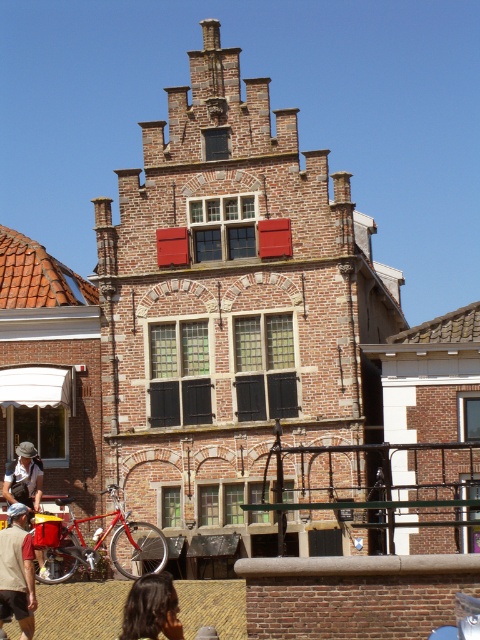
Consider the image. Can you confirm if green glass window at center is positioned above dark brown hair at lower left?

Yes, green glass window at center is above dark brown hair at lower left.

Is point (181, 348) farther from viewer compared to point (164, 588)?

Yes, point (181, 348) is farther from viewer.

This screenshot has width=480, height=640. I want to click on green glass window at center, so click(x=180, y=372).

Can you confirm if matte red shutter at center is positioned to the right of red matte shutter at upper center?

Yes, matte red shutter at center is to the right of red matte shutter at upper center.

Between matte red shutter at center and red matte shutter at upper center, which one appears on the right side from the viewer's perspective?

matte red shutter at center

Is point (268, 241) positioned after point (163, 248)?

No.

You are a GUI agent. You are given a task and a screenshot of the screen. Output one action in this format:
    pyautogui.click(x=<x>, y=<y>)
    Task: Click on the matte red shutter at center
    This screenshot has height=640, width=480.
    Given the screenshot: What is the action you would take?
    (x=275, y=237)

Who is more forward, (x=34, y=552) or (x=139, y=600)?

Point (x=139, y=600) is more forward.

Identify the location of tan cotton shirt at lower left. The image size is (480, 640). (16, 572).

The width and height of the screenshot is (480, 640). Identify the location of tan cotton shirt at lower left. (16, 572).